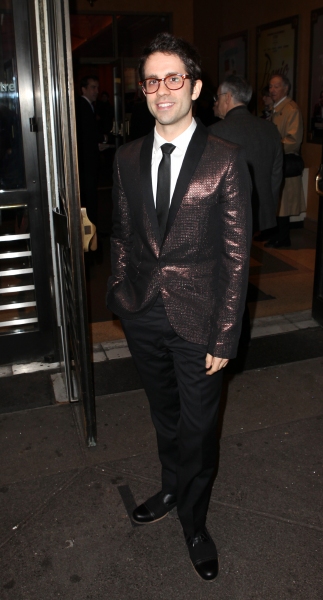
You are a GUI agent. You are given a task and a screenshot of the screen. Output one action in this format:
    pyautogui.click(x=<x>, y=<y>)
    Task: Click on the floor
    The height and width of the screenshot is (600, 323).
    Given the screenshot: What is the action you would take?
    pyautogui.click(x=95, y=499)